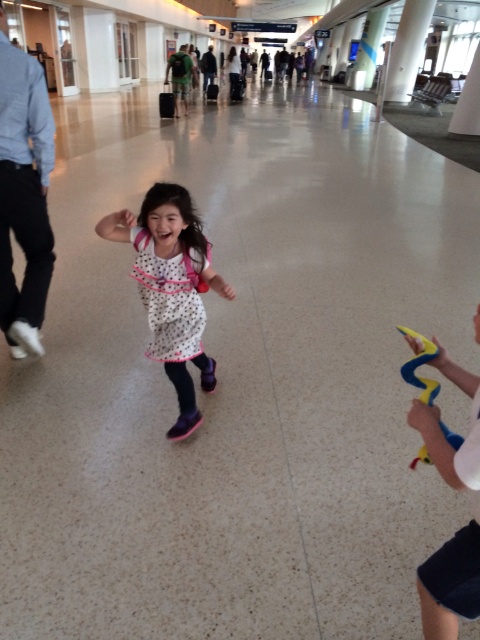
Looking at this image, please use the coordinates provided to determine the position of the light blue shirt at left relative to the center of the image. Is it to the left, right, above, or below the center?

The light blue shirt at left is located at coordinates point (24, 195), which places it to the left and below the center of the image.